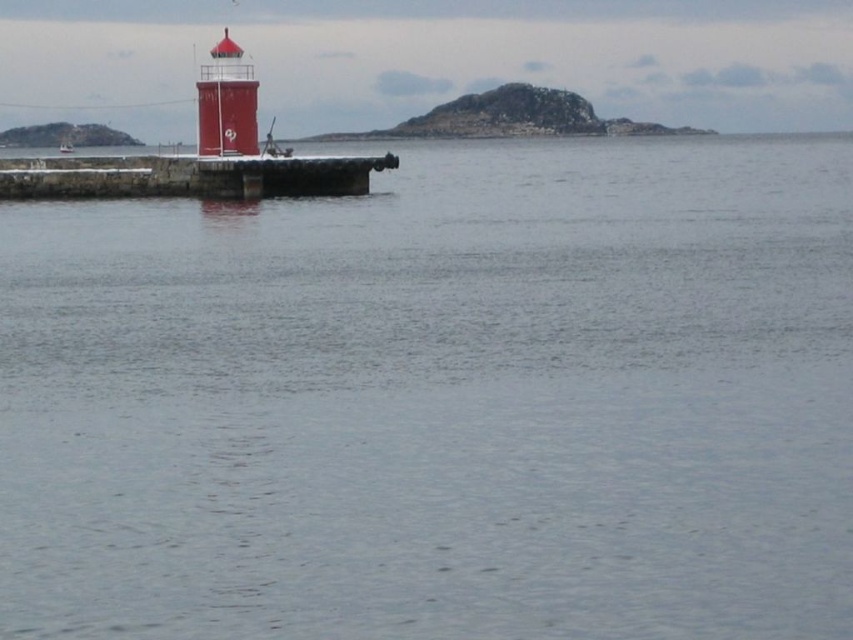
Question: Among these points, which one is nearest to the camera?

Choices:
 (A) (68, 144)
 (B) (224, 193)
 (C) (209, 125)

Answer: (B)

Question: Is smooth red lighthouse at center thinner than metallic silver boat at left?

Choices:
 (A) no
 (B) yes

Answer: (B)

Question: Which object is farther from the camera taking this photo?

Choices:
 (A) metallic silver boat at left
 (B) smooth red lighthouse at center

Answer: (A)

Question: Can you confirm if smooth red lighthouse at center is smaller than metallic silver boat at left?

Choices:
 (A) no
 (B) yes

Answer: (B)

Question: From the image, what is the correct spatial relationship of smooth stone dock at center in relation to smooth red lighthouse at center?

Choices:
 (A) right
 (B) left

Answer: (B)

Question: Estimate the real-world distances between objects in this image. Which object is farther from the smooth stone dock at center?

Choices:
 (A) metallic silver boat at left
 (B) smooth red lighthouse at center

Answer: (A)